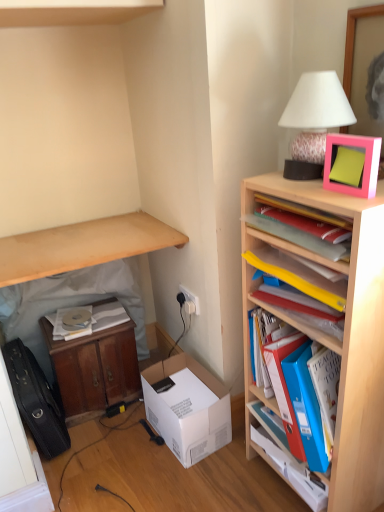
Question: From a real-world perspective, relative to wooden cabinet at lower left, which ranks as the first table in left-to-right order, is yellow plastic folders at upper right, which appears as the 3th shelf when ordered from the bottom, vertically above or below?

Choices:
 (A) above
 (B) below

Answer: (A)

Question: Relative to wooden cabinet at lower left, which ranks as the first table in left-to-right order, is yellow plastic folders at upper right, which appears as the 1th shelf when viewed from the top, in front or behind?

Choices:
 (A) behind
 (B) front

Answer: (B)

Question: Which object is the farthest from the wooden cabinet at lower left, which ranks as the first table in left-to-right order?

Choices:
 (A) pink matte picture frame at upper right
 (B) white cardboard box at lower center
 (C) wooden bookshelf at right, acting as the second shelf starting from the bottom
 (D) white matte table lamp at upper right
 (E) white plastic electric outlet at center

Answer: (A)

Question: Considering the real-world distances, which object is closest to the blue plastic folders at right, which ranks as the first shelf in bottom-to-top order?

Choices:
 (A) wooden bookshelf at right, placed as the 2th shelf when sorted from top to bottom
 (B) pink matte picture frame at upper right
 (C) white matte table lamp at upper right
 (D) wooden cabinet at lower left, which ranks as the first table in left-to-right order
 (E) pink plastic frame at upper right, which is the first book from top to bottom

Answer: (A)